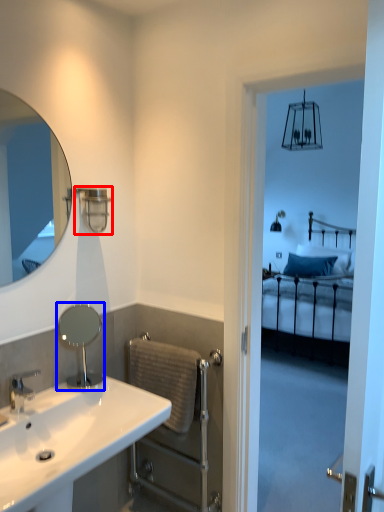
Question: Which point is closer to the camera, shower (highlighted by a red box) or mirror (highlighted by a blue box)?

Choices:
 (A) shower
 (B) mirror

Answer: (B)